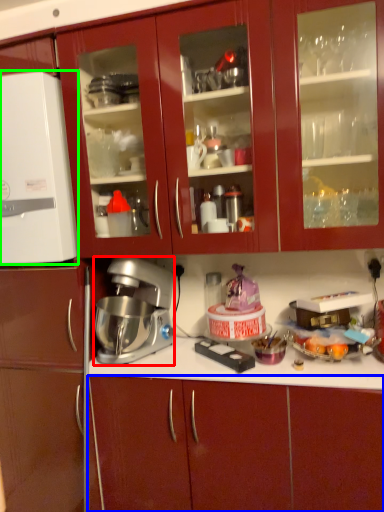
Question: Considering the real-world distances, which object is farthest from mixer (highlighted by a red box)? cabinetry (highlighted by a blue box) or appliance (highlighted by a green box)?

Choices:
 (A) cabinetry
 (B) appliance

Answer: (A)